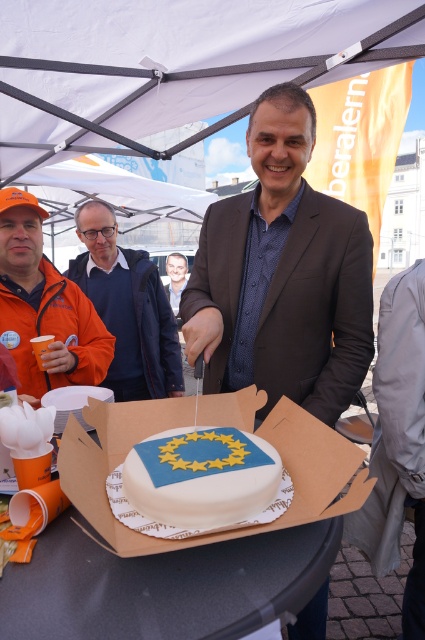
Question: Which object appears farthest from the camera in this image?

Choices:
 (A) smooth gray suit at center
 (B) blue fondant cake at center
 (C) orange fabric jacket at upper left

Answer: (A)

Question: Is matte brown suit at center positioned before blue fabric jacket at center?

Choices:
 (A) yes
 (B) no

Answer: (A)

Question: Which is nearer to the matte brown suit at center?

Choices:
 (A) orange fabric jacket at upper left
 (B) smooth gray suit at center
 (C) blue fabric jacket at center

Answer: (A)

Question: Does orange fabric jacket at upper left have a smaller size compared to smooth gray suit at center?

Choices:
 (A) yes
 (B) no

Answer: (A)

Question: Which point is farther to the camera?

Choices:
 (A) (181, 500)
 (B) (5, 260)
 (C) (184, 282)
 (D) (121, 289)

Answer: (C)

Question: Is the position of blue fabric jacket at center less distant than that of smooth gray suit at center?

Choices:
 (A) no
 (B) yes

Answer: (B)